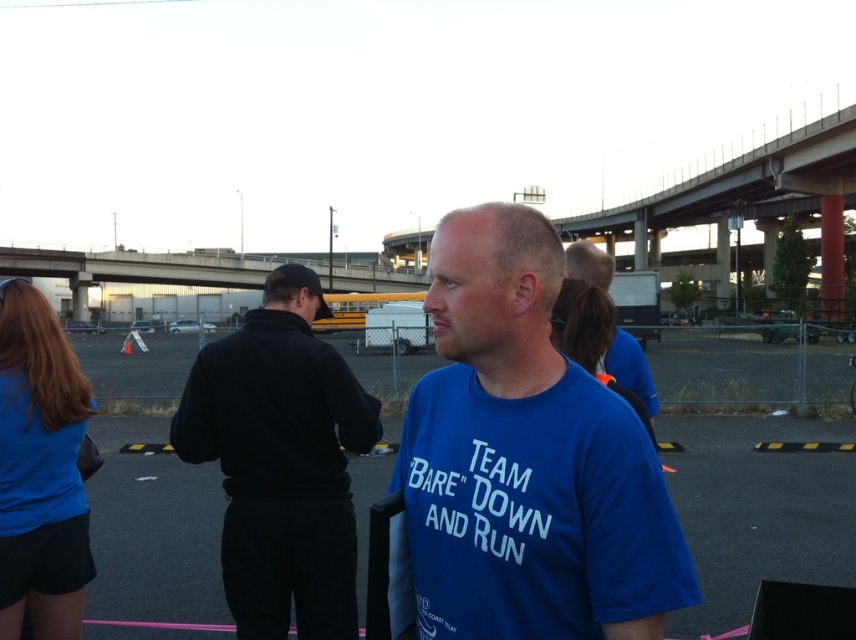
What do you see at coordinates (522, 464) in the screenshot? The width and height of the screenshot is (856, 640). I see `blue cotton t-shirt at center` at bounding box center [522, 464].

Who is positioned more to the right, blue cotton t-shirt at center or black fleece jacket at center?

From the viewer's perspective, blue cotton t-shirt at center appears more on the right side.

What do you see at coordinates (522, 464) in the screenshot? I see `blue cotton t-shirt at center` at bounding box center [522, 464].

Find the location of a particular element. This screenshot has height=640, width=856. blue cotton t-shirt at center is located at coordinates (522, 464).

Describe the element at coordinates (281, 461) in the screenshot. I see `black fleece jacket at center` at that location.

Which is behind, point (345, 534) or point (39, 316)?

The point (39, 316) is behind.

Where is `black fleece jacket at center`? black fleece jacket at center is located at coordinates (281, 461).

Is point (414, 576) behind point (1, 600)?

That is False.

Is blue cotton t-shirt at center wider than matte blue shirt at left?

Indeed, blue cotton t-shirt at center has a greater width compared to matte blue shirt at left.

Image resolution: width=856 pixels, height=640 pixels. What do you see at coordinates (522, 464) in the screenshot?
I see `blue cotton t-shirt at center` at bounding box center [522, 464].

Find the location of a particular element. The width and height of the screenshot is (856, 640). blue cotton t-shirt at center is located at coordinates (522, 464).